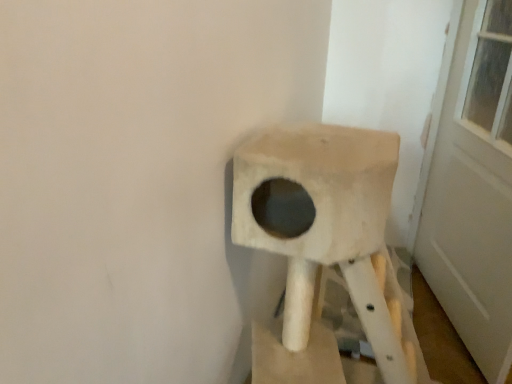
What do you see at coordinates (318, 240) in the screenshot? The width and height of the screenshot is (512, 384). I see `beige fabric cat tree at center` at bounding box center [318, 240].

Locate an element on the screen. This screenshot has width=512, height=384. beige fabric cat tree at center is located at coordinates (318, 240).

This screenshot has height=384, width=512. What do you see at coordinates (472, 185) in the screenshot?
I see `white matte door at upper right` at bounding box center [472, 185].

At what (x,y) coordinates should I click in order to perform the action: click on white matte door at upper right. Please return your answer as a coordinate pair (x, y). Looking at the image, I should click on tap(472, 185).

Identify the location of beige fabric cat tree at center. This screenshot has width=512, height=384. (318, 240).

Is beige fabric cat tree at center to the right of white matte door at upper right from the viewer's perspective?

No.

Consider the image. Between beige fabric cat tree at center and white matte door at upper right, which one is positioned in front?

Positioned in front is beige fabric cat tree at center.

Is point (356, 189) less distant than point (478, 297)?

That is True.

From the image's perspective, between beige fabric cat tree at center and white matte door at upper right, which one is located above?

white matte door at upper right appears higher in the image.

From a real-world perspective, is beige fabric cat tree at center under white matte door at upper right?

Yes, from a real-world perspective, beige fabric cat tree at center is below white matte door at upper right.

Which of these two, beige fabric cat tree at center or white matte door at upper right, is thinner?

With smaller width is white matte door at upper right.

Between beige fabric cat tree at center and white matte door at upper right, which one has more height?

white matte door at upper right.

Which of these two, beige fabric cat tree at center or white matte door at upper right, is smaller?

white matte door at upper right is smaller.

Can we say beige fabric cat tree at center lies outside white matte door at upper right?

Yes.

Is beige fabric cat tree at center directly adjacent to white matte door at upper right?

No, beige fabric cat tree at center is not in contact with white matte door at upper right.

Could you tell me if beige fabric cat tree at center is turned towards white matte door at upper right?

No, beige fabric cat tree at center is not oriented towards white matte door at upper right.

Can you tell me how much beige fabric cat tree at center and white matte door at upper right differ in facing direction?

The angle between the facing direction of beige fabric cat tree at center and the facing direction of white matte door at upper right is 20.2 degrees.

From the picture: How far apart are beige fabric cat tree at center and white matte door at upper right?

They are 26.44 inches apart.

This screenshot has width=512, height=384. What are the coordinates of `door that appears behind the beige fabric cat tree at center` in the screenshot? It's located at (472, 185).

Which object is positioned more to the right, white matte door at upper right or beige fabric cat tree at center?

Positioned to the right is white matte door at upper right.

Considering their positions, is white matte door at upper right located in front of or behind beige fabric cat tree at center?

Clearly, white matte door at upper right is behind beige fabric cat tree at center.

Which point is more forward, (469, 62) or (309, 227)?

The point (309, 227) is closer.

From the image's perspective, is white matte door at upper right located beneath beige fabric cat tree at center?

No.

From a real-world perspective, does white matte door at upper right sit lower than beige fabric cat tree at center?

No, from a real-world perspective, white matte door at upper right is not below beige fabric cat tree at center.

Can you confirm if white matte door at upper right is wider than beige fabric cat tree at center?

In fact, white matte door at upper right might be narrower than beige fabric cat tree at center.

In terms of height, does white matte door at upper right look taller or shorter compared to beige fabric cat tree at center?

Clearly, white matte door at upper right is taller compared to beige fabric cat tree at center.

Based on the photo, in terms of size, does white matte door at upper right appear bigger or smaller than beige fabric cat tree at center?

In the image, white matte door at upper right appears to be smaller than beige fabric cat tree at center.

Is white matte door at upper right spatially inside beige fabric cat tree at center, or outside of it?

white matte door at upper right is not enclosed by beige fabric cat tree at center.

Is there a large distance between white matte door at upper right and beige fabric cat tree at center?

white matte door at upper right is near beige fabric cat tree at center, not far away.

Is white matte door at upper right looking in the opposite direction of beige fabric cat tree at center?

Yes, white matte door at upper right is facing away from beige fabric cat tree at center.

This screenshot has height=384, width=512. In order to click on swivel chair to the left of white matte door at upper right in this screenshot , I will do `click(318, 240)`.

The width and height of the screenshot is (512, 384). I want to click on door above the beige fabric cat tree at center (from a real-world perspective), so click(472, 185).

This screenshot has height=384, width=512. Identify the location of door that is behind the beige fabric cat tree at center. (472, 185).